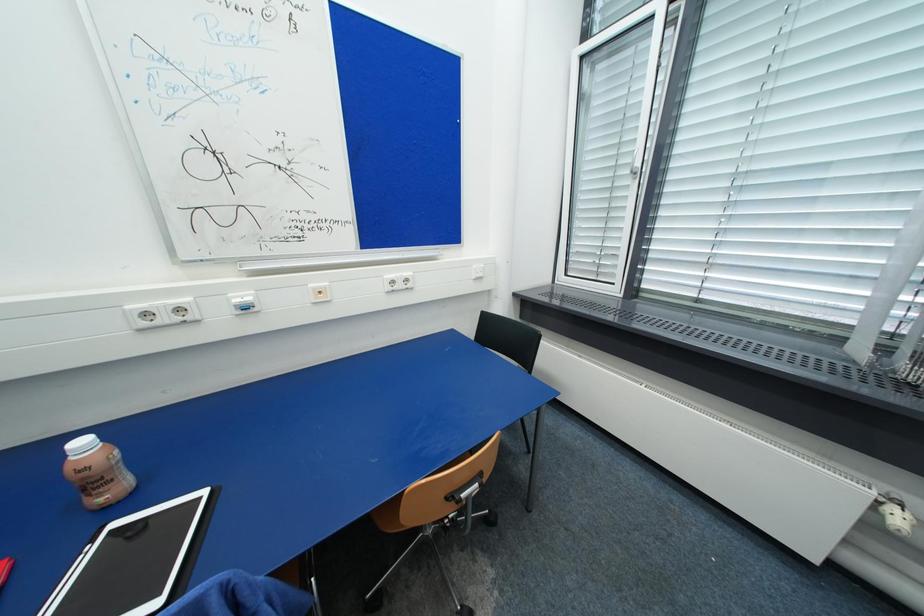
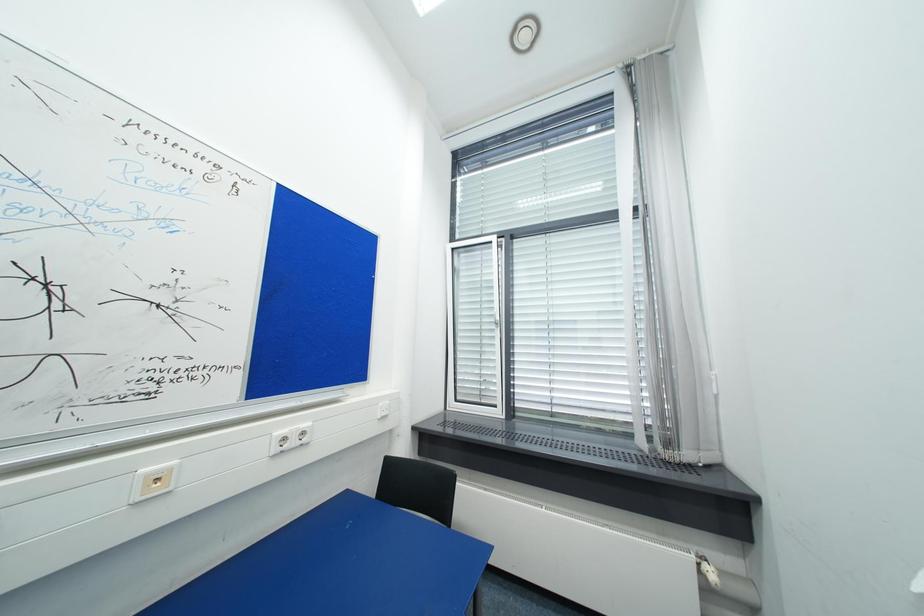
Based on the continuous images, in which direction is the camera rotating?

The camera's rotation is toward right-up.